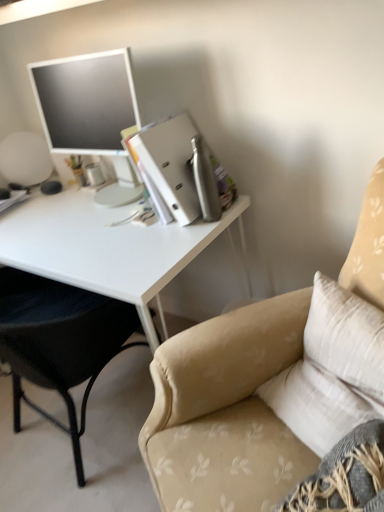
Question: Is white glossy desk at left wider or thinner than beige fabric chair at left, which is the 2th chair in right-to-left order?

Choices:
 (A) wide
 (B) thin

Answer: (A)

Question: Considering the positions of point (142, 272) and point (29, 378), is point (142, 272) closer or farther from the camera than point (29, 378)?

Choices:
 (A) closer
 (B) farther

Answer: (A)

Question: Based on their relative distances, which object is farther from the beige fabric chair at upper right, which appears as the 1th chair when viewed from the right?

Choices:
 (A) white glossy desk at left
 (B) beige fabric chair at left, which is the 2th chair in right-to-left order
 (C) matte silver monitor at upper left
 (D) metallic silver binder at upper right

Answer: (C)

Question: Estimate the real-world distances between objects in this image. Which object is farther from the white glossy desk at left?

Choices:
 (A) matte silver monitor at upper left
 (B) metallic silver binder at upper right
 (C) beige fabric chair at upper right, which appears as the 1th chair when viewed from the right
 (D) beige fabric chair at left, the first chair positioned from the left

Answer: (C)